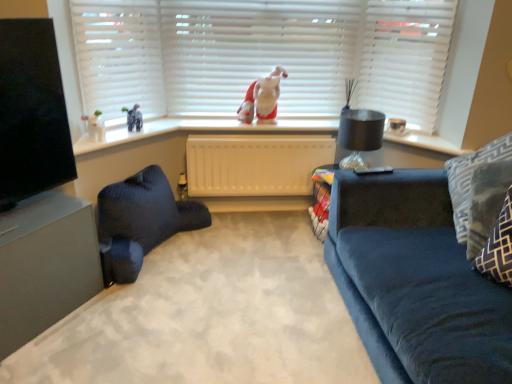
Question: From a real-world perspective, is fuzzy fabric santa at center over patterned fabric pillow at right, which appears as the first pillow when viewed from the front?

Choices:
 (A) no
 (B) yes

Answer: (B)

Question: From a real-world perspective, is fuzzy fabric santa at center under patterned fabric pillow at right, the 2th pillow positioned from the back?

Choices:
 (A) no
 (B) yes

Answer: (A)

Question: Does fuzzy fabric santa at center have a lesser height compared to patterned fabric pillow at right, the 2th pillow positioned from the back?

Choices:
 (A) no
 (B) yes

Answer: (B)

Question: Is fuzzy fabric santa at center located outside patterned fabric pillow at right, which appears as the first pillow when viewed from the front?

Choices:
 (A) yes
 (B) no

Answer: (A)

Question: Is fuzzy fabric santa at center taller than patterned fabric pillow at right, which appears as the first pillow when viewed from the front?

Choices:
 (A) no
 (B) yes

Answer: (A)

Question: In the image, is matte gray entertainment center at left on the left side or the right side of white matte shutter at upper right?

Choices:
 (A) left
 (B) right

Answer: (A)

Question: Considering the positions of matte gray entertainment center at left and white matte shutter at upper right in the image, is matte gray entertainment center at left wider or thinner than white matte shutter at upper right?

Choices:
 (A) wide
 (B) thin

Answer: (A)

Question: From the image's perspective, is matte gray entertainment center at left positioned above or below white matte shutter at upper right?

Choices:
 (A) above
 (B) below

Answer: (B)

Question: Considering the positions of point (81, 299) and point (389, 94), is point (81, 299) closer or farther from the camera than point (389, 94)?

Choices:
 (A) closer
 (B) farther

Answer: (A)

Question: From the image's perspective, relative to matte gray entertainment center at left, is black glass lamp at upper right above or below?

Choices:
 (A) below
 (B) above

Answer: (B)

Question: Is black glass lamp at upper right taller or shorter than matte gray entertainment center at left?

Choices:
 (A) short
 (B) tall

Answer: (A)

Question: Looking at the image, does black glass lamp at upper right seem bigger or smaller compared to matte gray entertainment center at left?

Choices:
 (A) small
 (B) big

Answer: (A)

Question: Looking at their shapes, would you say black glass lamp at upper right is wider or thinner than matte gray entertainment center at left?

Choices:
 (A) thin
 (B) wide

Answer: (A)

Question: Considering the positions of white matte blinds at upper center and white matte blinds at upper center in the image, is white matte blinds at upper center wider or thinner than white matte blinds at upper center?

Choices:
 (A) thin
 (B) wide

Answer: (B)

Question: Considering their positions, is white matte blinds at upper center located in front of or behind white matte blinds at upper center?

Choices:
 (A) behind
 (B) front

Answer: (A)